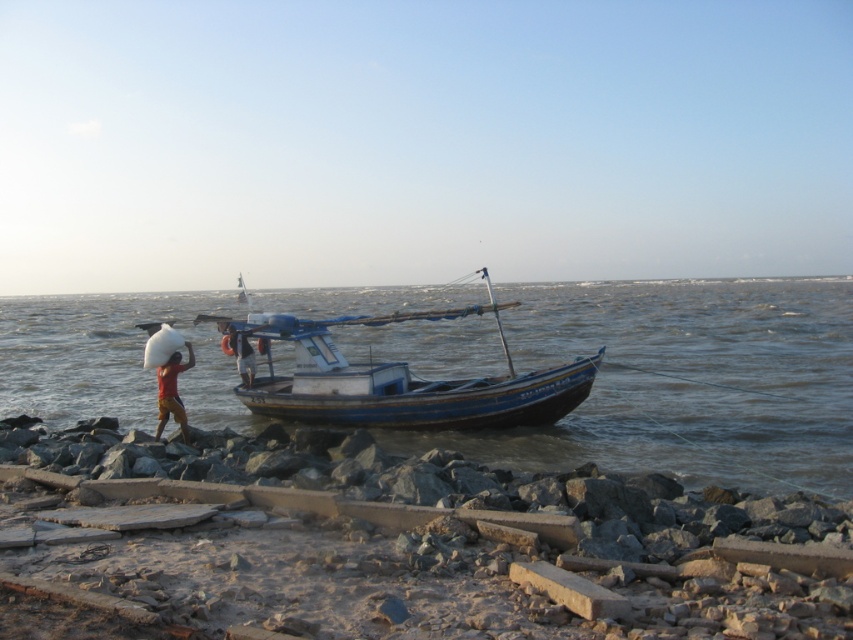
Measure the distance between point [91,340] and camera.

Point [91,340] and camera are 130.89 feet apart from each other.

Between point (120, 378) and point (476, 308), which one is positioned behind?

The point (120, 378) is behind.

Is point (467, 323) closer to camera compared to point (434, 320)?

No, it is behind (434, 320).

Locate an element on the screen. The height and width of the screenshot is (640, 853). blue wooden boat at lower center is located at coordinates (685, 381).

Describe the element at coordinates (172, 392) in the screenshot. I see `red fabric bag at center` at that location.

Is red fabric bag at center positioned before dark blue fabric shirt at center?

Yes, it is in front of dark blue fabric shirt at center.

This screenshot has width=853, height=640. Find the location of `red fabric bag at center`. red fabric bag at center is located at coordinates (172, 392).

Between blue wooden boat at lower center and red fabric bag at center, which one has less height?

red fabric bag at center is shorter.

Is point (737, 374) positioned in front of point (157, 387)?

No, (737, 374) is behind (157, 387).

At what (x,y) coordinates should I click in order to perform the action: click on blue wooden boat at lower center. Please return your answer as a coordinate pair (x, y). The image size is (853, 640). Looking at the image, I should click on (685, 381).